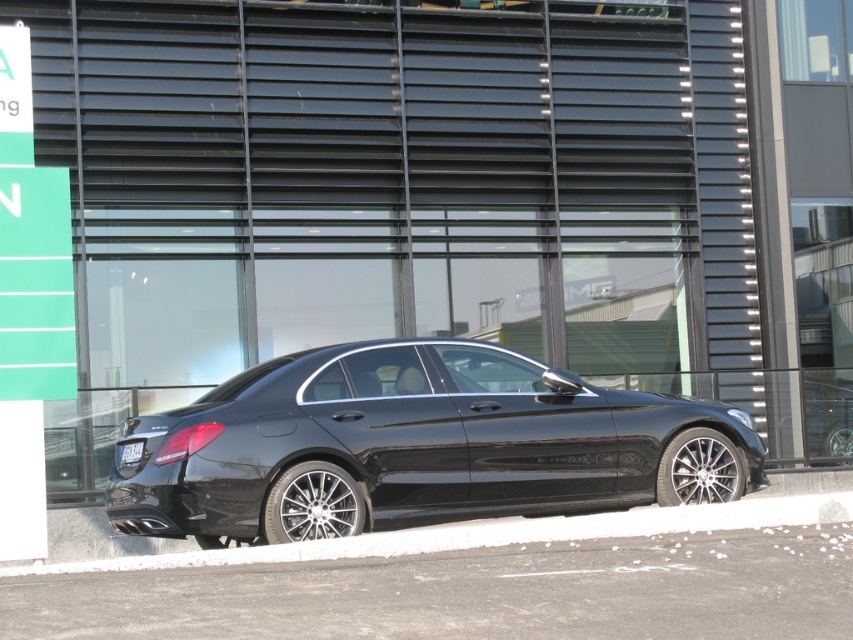
Based on the photo, can you confirm if white painted concrete at lower center is taller than black matte license plate at rear?

Yes, white painted concrete at lower center is taller than black matte license plate at rear.

Between white painted concrete at lower center and black matte license plate at rear, which one appears on the left side from the viewer's perspective?

From the viewer's perspective, black matte license plate at rear appears more on the left side.

Is point (799, 524) positioned behind point (141, 449)?

No, (799, 524) is in front of (141, 449).

In order to click on white painted concrete at lower center in this screenshot , I will do `click(492, 534)`.

Who is positioned more to the right, black metallic car at center or black matte license plate at rear?

Positioned to the right is black metallic car at center.

Find the location of `black metallic car at center`. black metallic car at center is located at coordinates (416, 445).

The width and height of the screenshot is (853, 640). I want to click on black metallic car at center, so click(416, 445).

Which is in front, point (573, 452) or point (677, 508)?

Point (677, 508)

The width and height of the screenshot is (853, 640). Describe the element at coordinates (416, 445) in the screenshot. I see `black metallic car at center` at that location.

Find the location of a particular element. black metallic car at center is located at coordinates (416, 445).